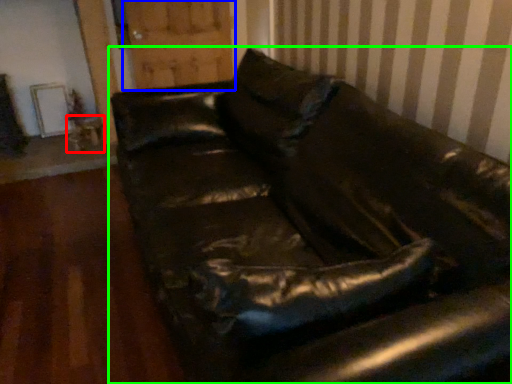
Question: Estimate the real-world distances between objects in this image. Which object is farther from table (highlighted by a red box), barn door (highlighted by a blue box) or studio couch (highlighted by a green box)?

Choices:
 (A) barn door
 (B) studio couch

Answer: (B)